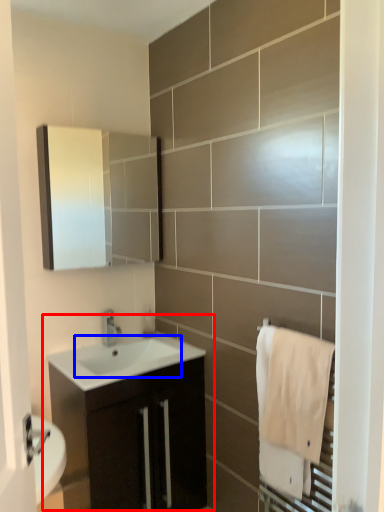
Question: Which of the following is the closest to the observer, bathroom cabinet (highlighted by a red box) or sink (highlighted by a blue box)?

Choices:
 (A) bathroom cabinet
 (B) sink

Answer: (A)